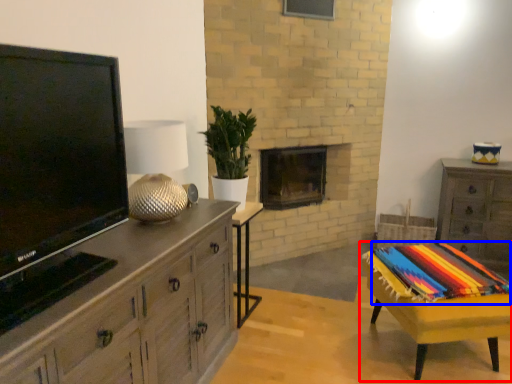
Question: Which object appears farthest to the camera in this image, table (highlighted by a red box) or blanket (highlighted by a blue box)?

Choices:
 (A) table
 (B) blanket

Answer: (B)